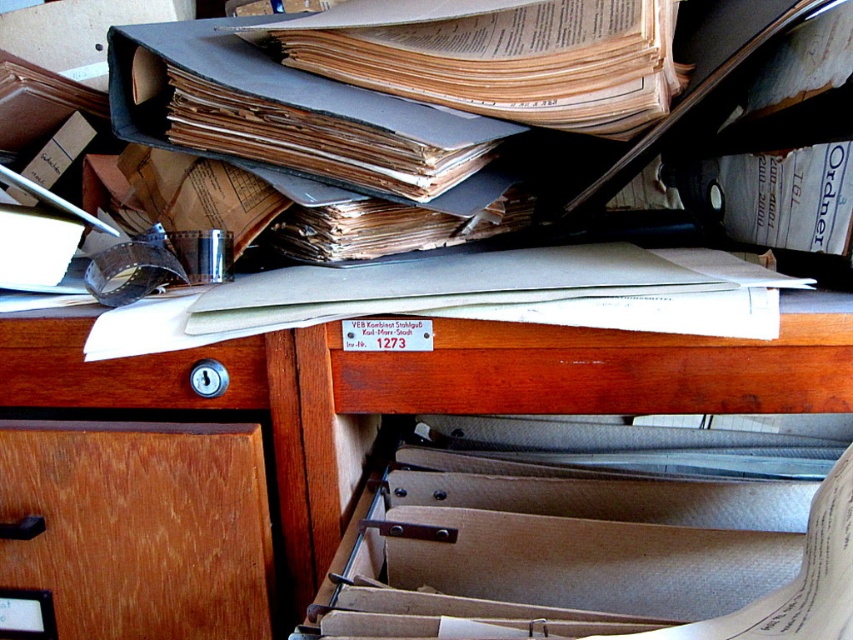
Is wooden desk at center bigger than wooden drawer at lower left?

Correct, wooden desk at center is larger in size than wooden drawer at lower left.

Which of these two, wooden desk at center or wooden drawer at lower left, stands shorter?

Standing shorter between the two is wooden drawer at lower left.

Between point (827, 378) and point (225, 452), which one is positioned in front?

Point (827, 378)

Where is `wooden desk at center`? Image resolution: width=853 pixels, height=640 pixels. wooden desk at center is located at coordinates (434, 388).

Does wooden drawer at lower left have a lesser width compared to wooden drawer at left?

Yes.

Find the location of a particular element. The height and width of the screenshot is (640, 853). wooden drawer at lower left is located at coordinates (138, 528).

Is point (229, 424) closer to camera compared to point (105, 406)?

Yes.

Identify the location of wooden drawer at lower left. The image size is (853, 640). (138, 528).

Based on the photo, is wooden desk at center shorter than wooden drawer at left?

No, wooden desk at center is not shorter than wooden drawer at left.

Is wooden desk at center in front of wooden drawer at left?

Yes, wooden desk at center is in front of wooden drawer at left.

Which is behind, point (303, 502) or point (30, 394)?

Positioned behind is point (30, 394).

The height and width of the screenshot is (640, 853). Find the location of `wooden desk at center`. wooden desk at center is located at coordinates (434, 388).